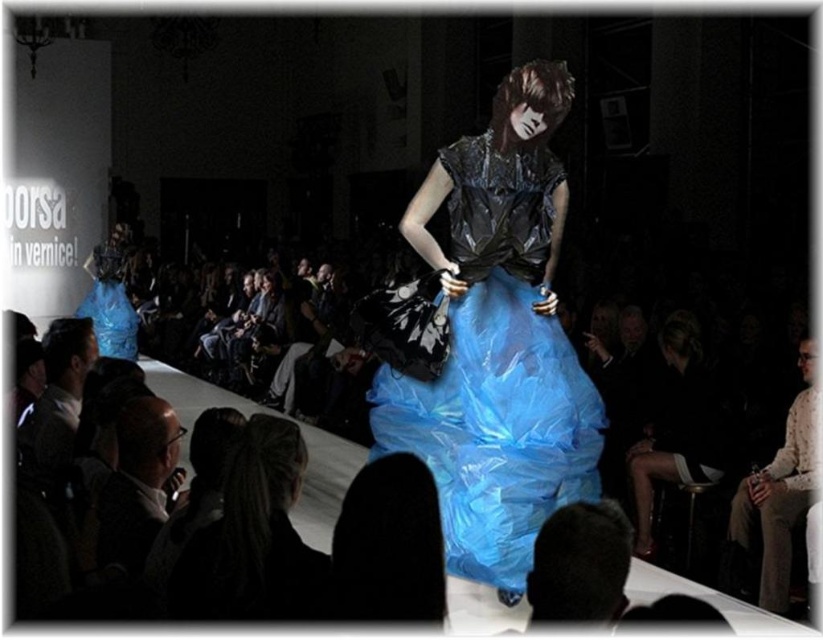
Question: Is light blue tulle skirt at center positioned in front of translucent blue dress at center?

Choices:
 (A) yes
 (B) no

Answer: (A)

Question: Observing the image, what is the correct spatial positioning of black satin dress at lower right in reference to translucent blue dress at center?

Choices:
 (A) below
 (B) above

Answer: (A)

Question: Is black satin dress at lower right to the right of translucent blue dress at center from the viewer's perspective?

Choices:
 (A) no
 (B) yes

Answer: (B)

Question: Which of the following is the closest to the observer?

Choices:
 (A) (654, 461)
 (B) (98, 252)
 (C) (524, 524)
 (D) (259, 452)

Answer: (D)

Question: Which point is farther to the camera?

Choices:
 (A) (282, 435)
 (B) (370, 451)

Answer: (B)

Question: Among these points, which one is farthest from the camera?

Choices:
 (A) (514, 408)
 (B) (119, 310)
 (C) (215, 600)
 (D) (705, 472)

Answer: (B)